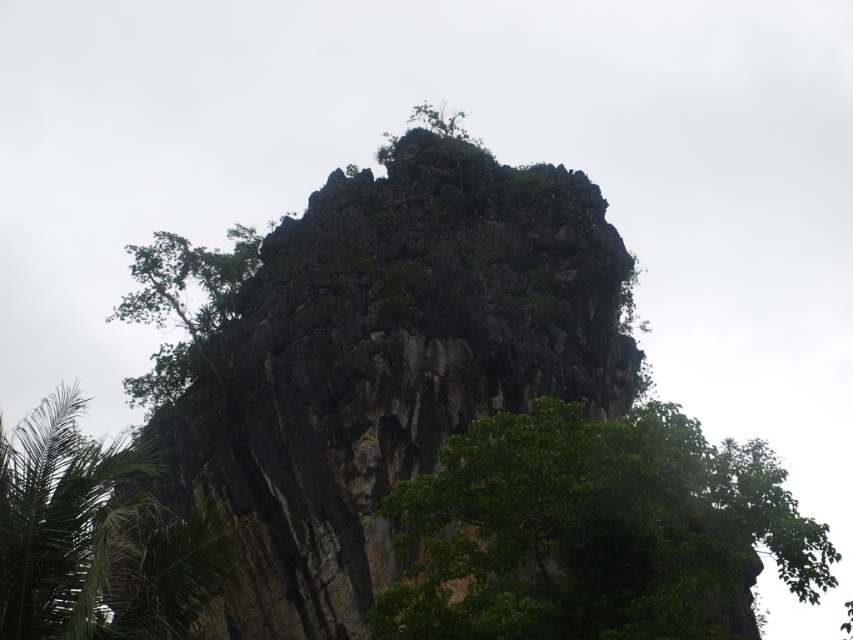
You are standing at the base of the towering rock formation and want to take a photo of the green leafy palm tree at lower left. If your camera can focus on objects up to 50 meters away, will it be able to capture the palm tree clearly?

The green leafy palm tree at lower left and camera are 55.97 meters apart from each other. Since the camera can only focus up to 50 meters, it will not be able to capture the palm tree clearly.

You are standing at the point marked as point (387, 362) in the image. What is the primary material you are standing on?

The dark rock formation at center is located at point (387, 362), so you are standing on dark rock formation at center.